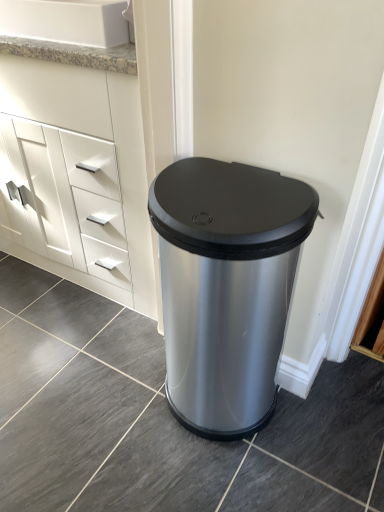
Question: Based on their positions, is white granite sink at upper left located to the left or right of white matte cabinet at left?

Choices:
 (A) left
 (B) right

Answer: (B)

Question: In terms of width, does white granite sink at upper left look wider or thinner when compared to white matte cabinet at left?

Choices:
 (A) thin
 (B) wide

Answer: (A)

Question: Based on their relative distances, which object is nearer to the satin silver trash can at center?

Choices:
 (A) white granite sink at upper left
 (B) white matte cabinet at left

Answer: (B)

Question: Based on their relative distances, which object is nearer to the satin silver trash can at center?

Choices:
 (A) white granite sink at upper left
 (B) white matte cabinet at left

Answer: (B)